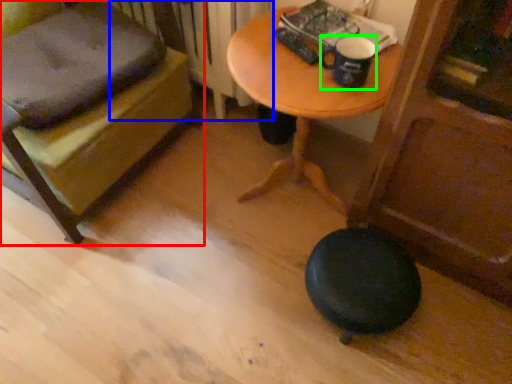
Question: Which is farther away from furniture (highlighted by a red box)? radiator (highlighted by a blue box) or mug (highlighted by a green box)?

Choices:
 (A) radiator
 (B) mug

Answer: (B)